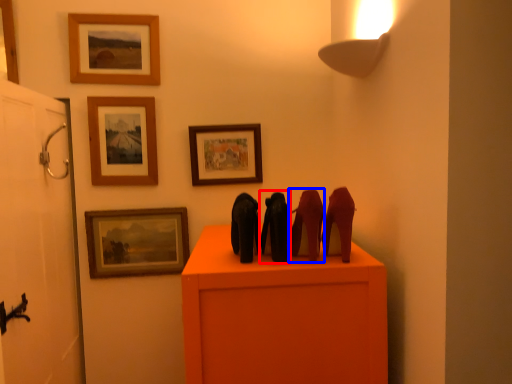
Question: Which point is further to the camera, animal (highlighted by a red box) or animal (highlighted by a blue box)?

Choices:
 (A) animal
 (B) animal

Answer: (A)